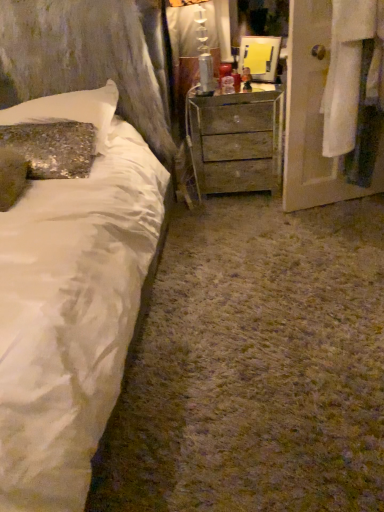
The image size is (384, 512). What do you see at coordinates (313, 117) in the screenshot?
I see `white fabric door at right` at bounding box center [313, 117].

I want to click on white fabric door at right, so click(313, 117).

This screenshot has height=512, width=384. I want to click on wooden chest of drawers at center, so click(x=236, y=140).

Which point is more distant from viewer, (x=68, y=384) or (x=53, y=116)?

Point (x=53, y=116)

From a real-world perspective, who is located higher, white satin bed at left or sparkly sequin pillow at upper left?

sparkly sequin pillow at upper left.

Which of these two, white satin bed at left or sparkly sequin pillow at upper left, is wider?

white satin bed at left is wider.

Is white satin bed at left facing towards sparkly sequin pillow at upper left?

No, white satin bed at left is not facing towards sparkly sequin pillow at upper left.

Does point (260, 100) come farther from viewer compared to point (95, 118)?

Yes, it is.

In the scene shown: From the image's perspective, which is below, wooden chest of drawers at center or sparkly sequin pillow at upper left?

wooden chest of drawers at center.

Is sparkly sequin pillow at upper left inside wooden chest of drawers at center?

That's incorrect, sparkly sequin pillow at upper left is not inside wooden chest of drawers at center.

Considering the sizes of wooden chest of drawers at center and sparkly sequin pillow at upper left in the image, is wooden chest of drawers at center taller or shorter than sparkly sequin pillow at upper left?

In the image, wooden chest of drawers at center appears to be taller than sparkly sequin pillow at upper left.

From the image's perspective, does white satin bed at left appear higher than white fabric door at right?

No, from the image's perspective, white satin bed at left is not above white fabric door at right.

The width and height of the screenshot is (384, 512). In the image, there is a white fabric door at right. Identify the location of bed below it (from the image's perspective). (71, 303).

Is white satin bed at left outside of white fabric door at right?

white satin bed at left lies outside white fabric door at right's area.

Is white fabric door at right at the back of white satin bed at left?

No.

Are sparkly sequin pillow at upper left and wooden chest of drawers at center making contact?

There is a gap between sparkly sequin pillow at upper left and wooden chest of drawers at center.

Consider the image. Does sparkly sequin pillow at upper left have a larger size compared to wooden chest of drawers at center?

Incorrect, sparkly sequin pillow at upper left is not larger than wooden chest of drawers at center.

Is sparkly sequin pillow at upper left closer to camera compared to wooden chest of drawers at center?

Yes, it is.

Does sparkly sequin pillow at upper left turn towards wooden chest of drawers at center?

No, sparkly sequin pillow at upper left is not aimed at wooden chest of drawers at center.

Which is behind, point (294, 209) or point (235, 175)?

Point (235, 175)

From the image's perspective, which one is positioned lower, white fabric door at right or wooden chest of drawers at center?

wooden chest of drawers at center appears lower in the image.

Can you confirm if white fabric door at right is taller than wooden chest of drawers at center?

Yes, white fabric door at right is taller than wooden chest of drawers at center.

Is white fabric door at right bigger than wooden chest of drawers at center?

No.

From the picture: Considering the positions of objects white fabric door at right and sparkly sequin pillow at upper left in the image provided, who is behind, white fabric door at right or sparkly sequin pillow at upper left?

sparkly sequin pillow at upper left is further away from the camera.

The height and width of the screenshot is (512, 384). I want to click on pillow that appears behind the white fabric door at right, so click(70, 110).

Considering the relative sizes of white fabric door at right and sparkly sequin pillow at upper left in the image provided, is white fabric door at right taller than sparkly sequin pillow at upper left?

Yes, white fabric door at right is taller than sparkly sequin pillow at upper left.

Between white fabric door at right and sparkly sequin pillow at upper left, which one has smaller size?

With smaller size is sparkly sequin pillow at upper left.

From the image's perspective, who appears lower, sparkly sequin pillow at upper left or white satin bed at left?

white satin bed at left appears lower in the image.

Does sparkly sequin pillow at upper left turn towards white satin bed at left?

Yes, sparkly sequin pillow at upper left is facing white satin bed at left.

Considering the relative sizes of sparkly sequin pillow at upper left and white satin bed at left in the image provided, is sparkly sequin pillow at upper left wider than white satin bed at left?

In fact, sparkly sequin pillow at upper left might be narrower than white satin bed at left.

Looking at the image, does sparkly sequin pillow at upper left seem bigger or smaller compared to white satin bed at left?

In the image, sparkly sequin pillow at upper left appears to be smaller than white satin bed at left.

At what (x,y) coordinates should I click in order to perform the action: click on pillow that is on the right side of white satin bed at left. Please return your answer as a coordinate pair (x, y). This screenshot has width=384, height=512. Looking at the image, I should click on (70, 110).

Where is `the chest of drawers located behind the sparkly sequin pillow at upper left`? This screenshot has width=384, height=512. the chest of drawers located behind the sparkly sequin pillow at upper left is located at coordinates (236, 140).

Which object lies nearer to the anchor point wooden chest of drawers at center, sparkly sequin pillow at upper left or white fabric door at right?

Among the two, white fabric door at right is located nearer to wooden chest of drawers at center.

From the image, which object appears to be nearer to white fabric door at right, wooden chest of drawers at center or sparkly sequin pillow at upper left?

Based on the image, wooden chest of drawers at center appears to be nearer to white fabric door at right.

Looking at the image, which one is located further to sparkly sequin pillow at upper left, white satin bed at left or wooden chest of drawers at center?

wooden chest of drawers at center is further to sparkly sequin pillow at upper left.

From the image, which object appears to be nearer to wooden chest of drawers at center, white fabric door at right or white satin bed at left?

white fabric door at right lies closer to wooden chest of drawers at center than the other object.

Considering their positions, is white satin bed at left positioned further to sparkly sequin pillow at upper left than white fabric door at right?

white fabric door at right is further to sparkly sequin pillow at upper left.

From the image, which object appears to be nearer to white satin bed at left, sparkly sequin pillow at upper left or wooden chest of drawers at center?

sparkly sequin pillow at upper left lies closer to white satin bed at left than the other object.

Estimate the real-world distances between objects in this image. Which object is closer to wooden chest of drawers at center, white satin bed at left or sparkly sequin pillow at upper left?

sparkly sequin pillow at upper left.

When comparing their distances from white fabric door at right, does sparkly sequin pillow at upper left or wooden chest of drawers at center seem closer?

Based on the image, wooden chest of drawers at center appears to be nearer to white fabric door at right.

You are a GUI agent. You are given a task and a screenshot of the screen. Output one action in this format:
    pyautogui.click(x=<x>, y=<y>)
    Task: Click on the armoire located between white satin bed at left and wooden chest of drawers at center in the depth direction
    This screenshot has width=384, height=512.
    Given the screenshot: What is the action you would take?
    pyautogui.click(x=313, y=117)

I want to click on pillow between white satin bed at left and white fabric door at right in the horizontal direction, so click(70, 110).

I want to click on pillow between white satin bed at left and wooden chest of drawers at center from front to back, so click(70, 110).

This screenshot has height=512, width=384. Identify the location of the chest of drawers situated between sparkly sequin pillow at upper left and white fabric door at right from left to right. [x=236, y=140].